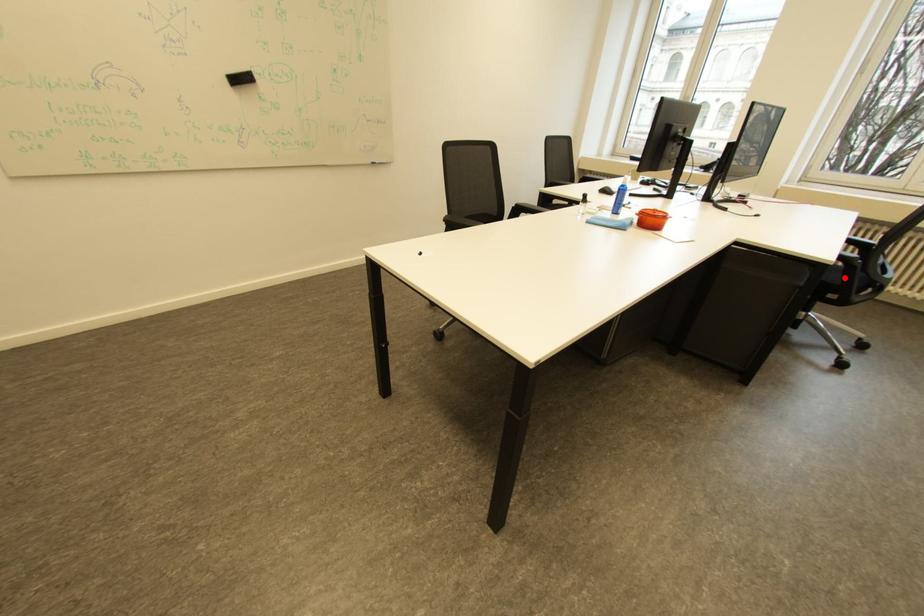
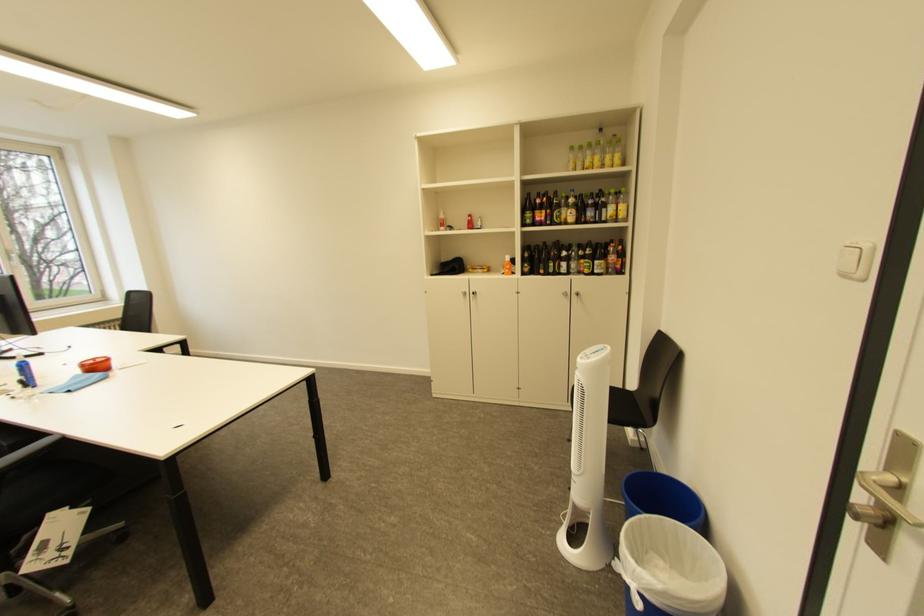
Question: I am providing you with two images of the same scene from different viewpoints. A red point is marked on the first image. Is the red point's position out of view in image 2?

Choices:
 (A) Yes
 (B) No

Answer: (A)